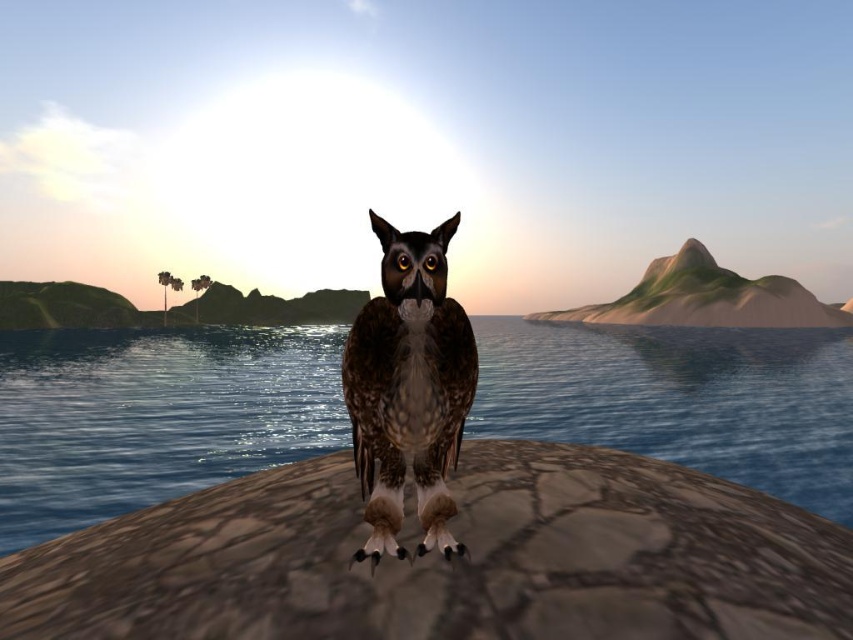
Question: Which object is positioned closest to the brown rough stone at center?

Choices:
 (A) blue water at center
 (B) brown speckled feathers at center

Answer: (B)

Question: Which object is the closest to the brown speckled feathers at center?

Choices:
 (A) brown rough stone at center
 (B) blue water at center

Answer: (A)

Question: Does brown rough stone at center have a larger size compared to blue water at center?

Choices:
 (A) yes
 (B) no

Answer: (B)

Question: Does brown rough stone at center appear over blue water at center?

Choices:
 (A) no
 (B) yes

Answer: (B)

Question: Can you confirm if brown rough stone at center is bigger than brown speckled feathers at center?

Choices:
 (A) yes
 (B) no

Answer: (A)

Question: Estimate the real-world distances between objects in this image. Which object is farther from the brown speckled feathers at center?

Choices:
 (A) blue water at center
 (B) brown rough stone at center

Answer: (A)